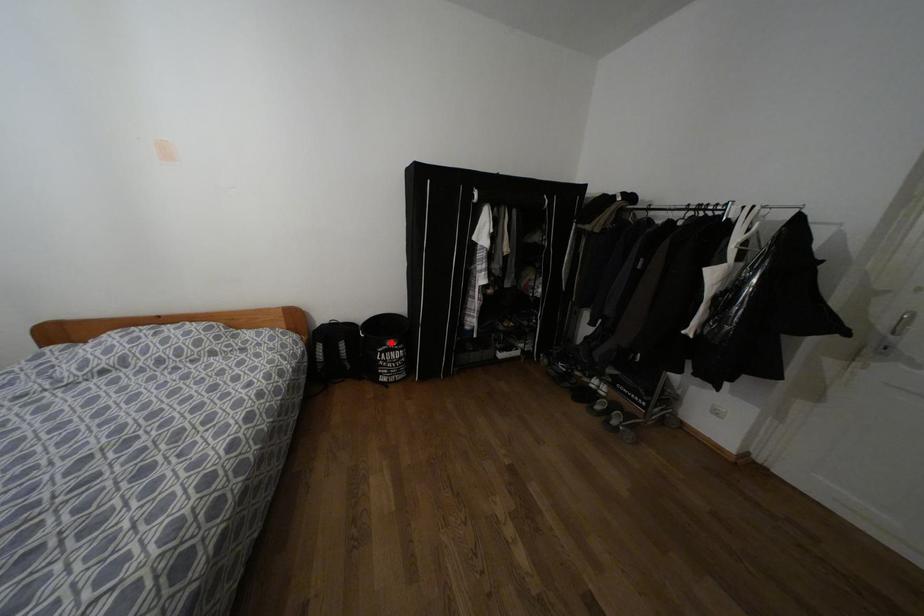
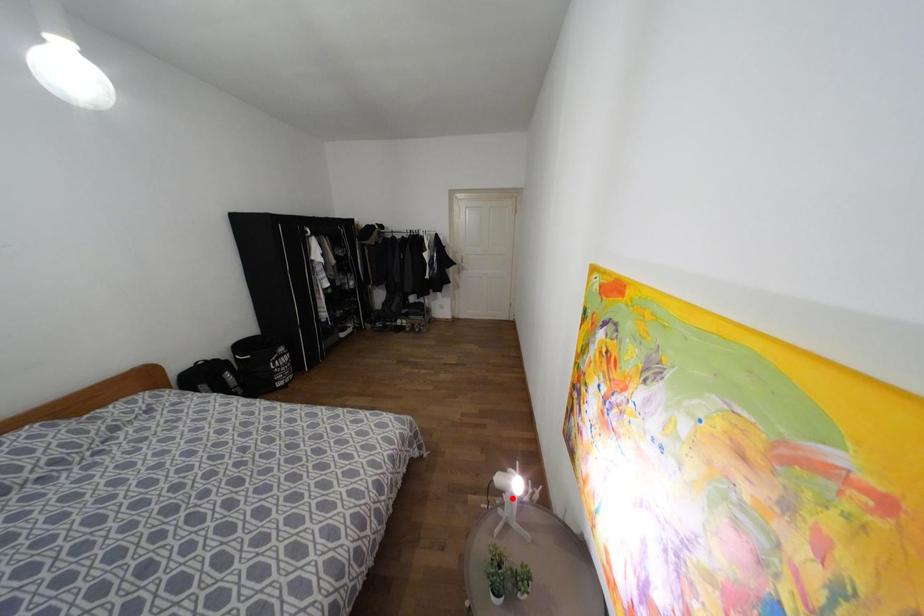
I am providing you with two images of the same scene from different viewpoints. A red point is marked on the first image and another point is marked on the second image. Are the points marked in image1 and image2 representing the same 3D position?

No